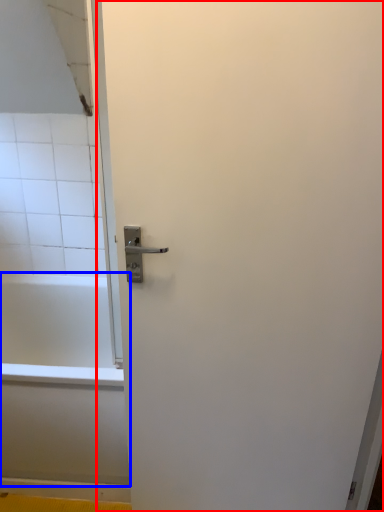
Question: Which of the following is the closest to the observer, screen door (highlighted by a red box) or bathtub (highlighted by a blue box)?

Choices:
 (A) screen door
 (B) bathtub

Answer: (A)